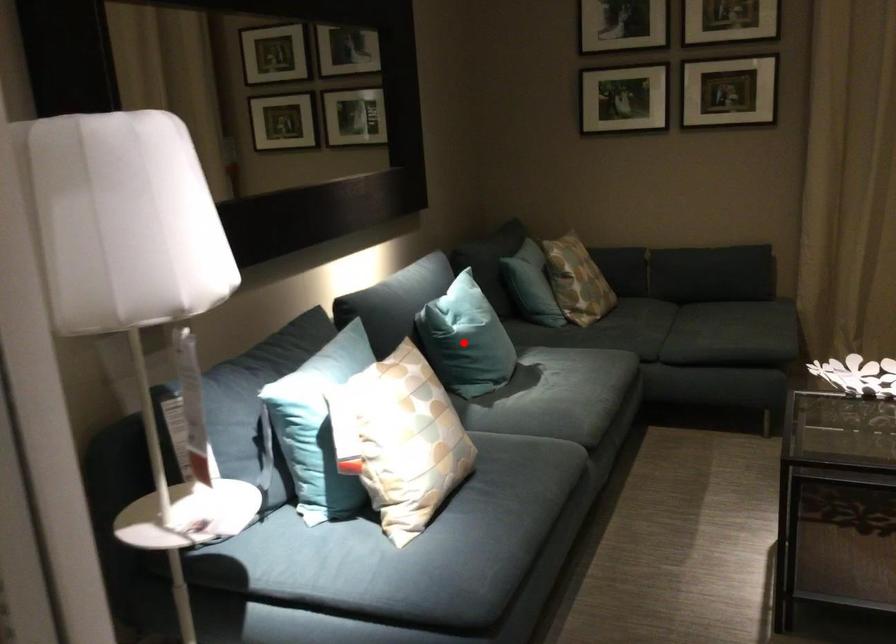
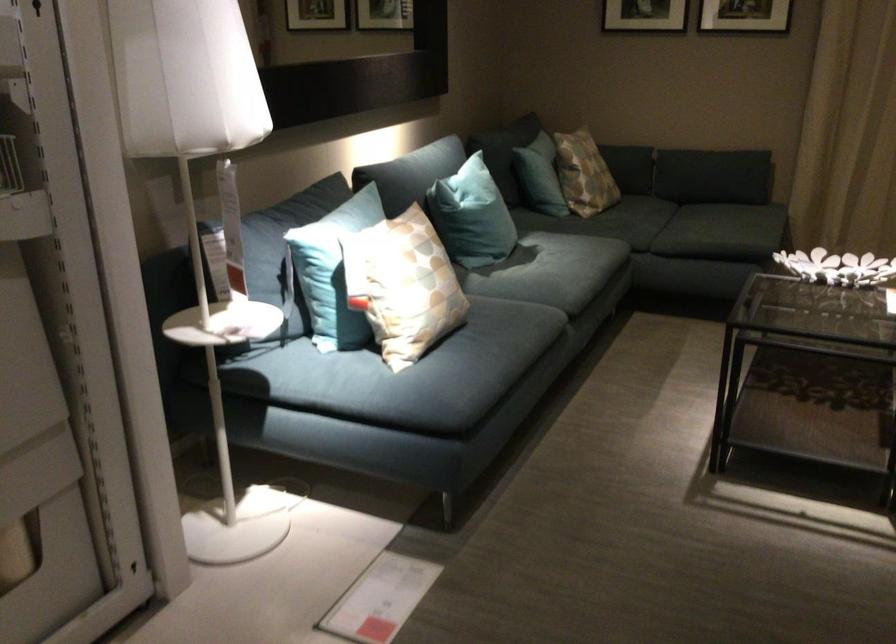
Question: I am providing you with two images of the same scene from different viewpoints. In image1, a red point is highlighted. Considering the same 3D point in image2, which of the following is correct?

Choices:
 (A) It is closer
 (B) It is farther

Answer: (B)